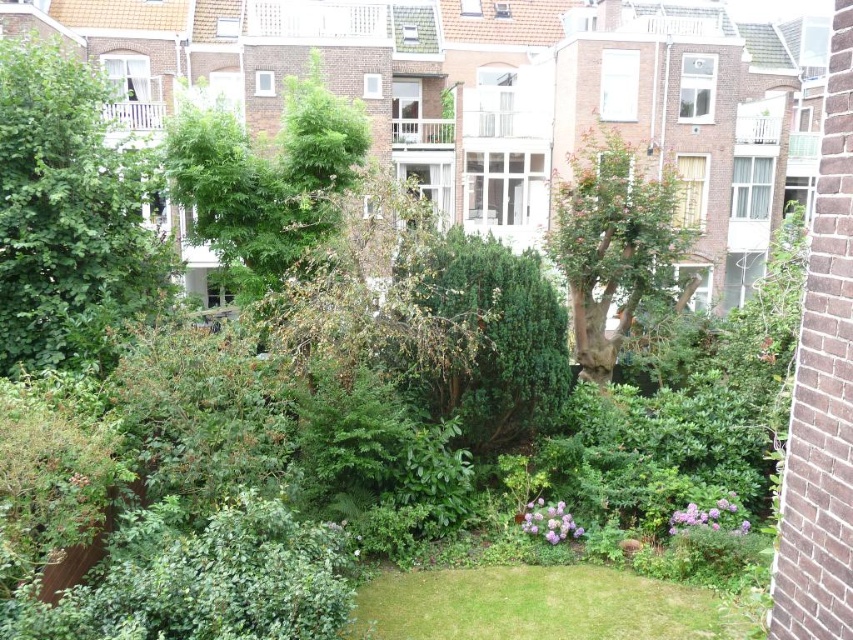
Where is `green leafy bush at center`? This screenshot has height=640, width=853. green leafy bush at center is located at coordinates (488, 340).

Between green leafy bush at center and green leafy tree at center, which one has more height?

green leafy tree at center is taller.

I want to click on green leafy bush at center, so click(x=488, y=340).

What are the coordinates of `green leafy bush at center` in the screenshot? It's located at (488, 340).

This screenshot has width=853, height=640. What do you see at coordinates (70, 216) in the screenshot? I see `green leafy tree at left` at bounding box center [70, 216].

The height and width of the screenshot is (640, 853). I want to click on green leafy tree at left, so click(70, 216).

Which is in front, point (566, 349) or point (621, 621)?

Point (621, 621) is in front.

Between green leafy bush at center and green grass at lower center, which one is positioned lower?

Positioned lower is green grass at lower center.

Find the location of a particular element. Image resolution: width=853 pixels, height=640 pixels. green leafy bush at center is located at coordinates (488, 340).

In order to click on green leafy bush at center in this screenshot , I will do `click(488, 340)`.